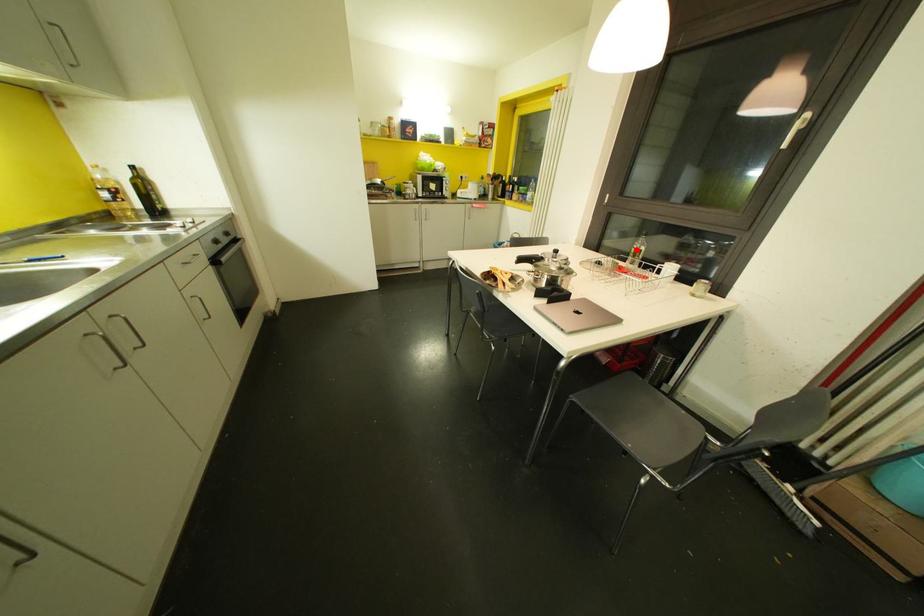
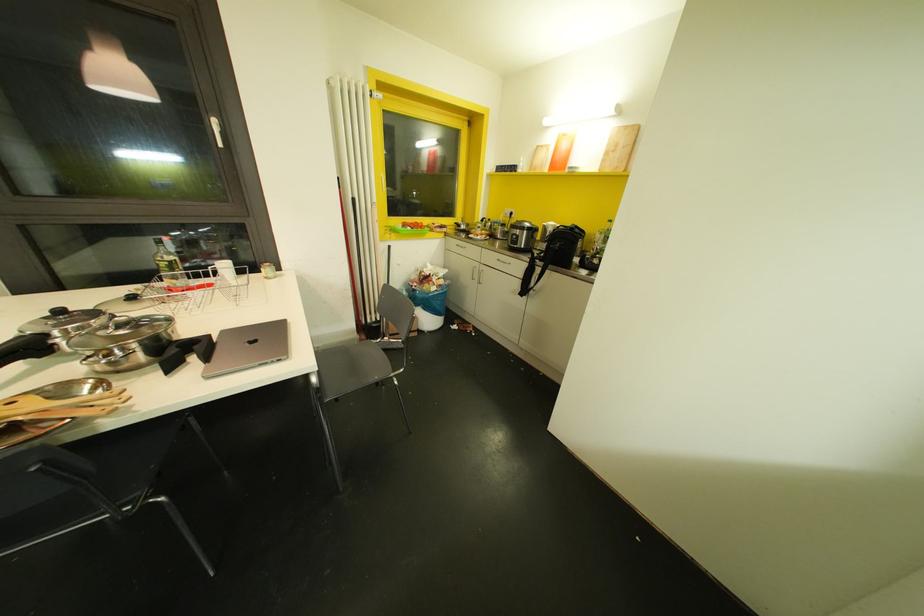
In the second image, find the point that corresponds to the highlighted location in the first image.

(169, 262)